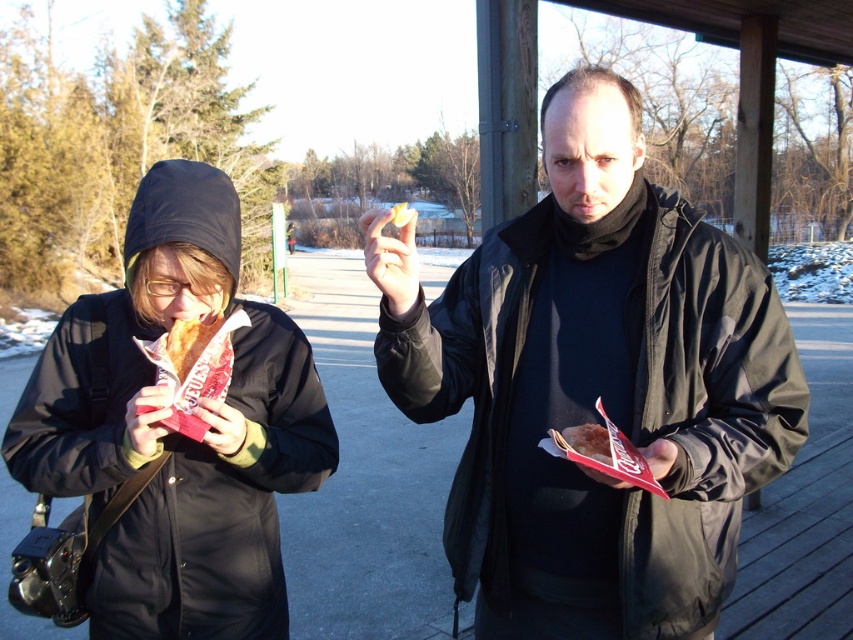
Does matte black jacket at left have a larger size compared to matte brown bagel at center?

Yes, matte black jacket at left is bigger than matte brown bagel at center.

Can you confirm if matte black jacket at left is positioned below matte brown bagel at center?

Incorrect, matte black jacket at left is not positioned below matte brown bagel at center.

Does point (289, 396) lie in front of point (605, 461)?

No, it is behind (605, 461).

This screenshot has width=853, height=640. Find the location of `matte black jacket at left`. matte black jacket at left is located at coordinates (171, 429).

Which is below, matte black jacket at center or matte black jacket at left?

Positioned lower is matte black jacket at left.

Can you confirm if matte black jacket at center is thinner than matte black jacket at left?

Answer: In fact, matte black jacket at center might be wider than matte black jacket at left.

Who is more forward, (579, 173) or (175, 182)?

Point (579, 173)

This screenshot has height=640, width=853. Find the location of `matte black jacket at center`. matte black jacket at center is located at coordinates (595, 387).

Is matte black jacket at center below matte brown bagel at center?

No, matte black jacket at center is not below matte brown bagel at center.

Who is positioned more to the left, matte black jacket at center or matte brown bagel at center?

From the viewer's perspective, matte black jacket at center appears more on the left side.

Locate an element on the screen. This screenshot has height=640, width=853. matte black jacket at center is located at coordinates (595, 387).